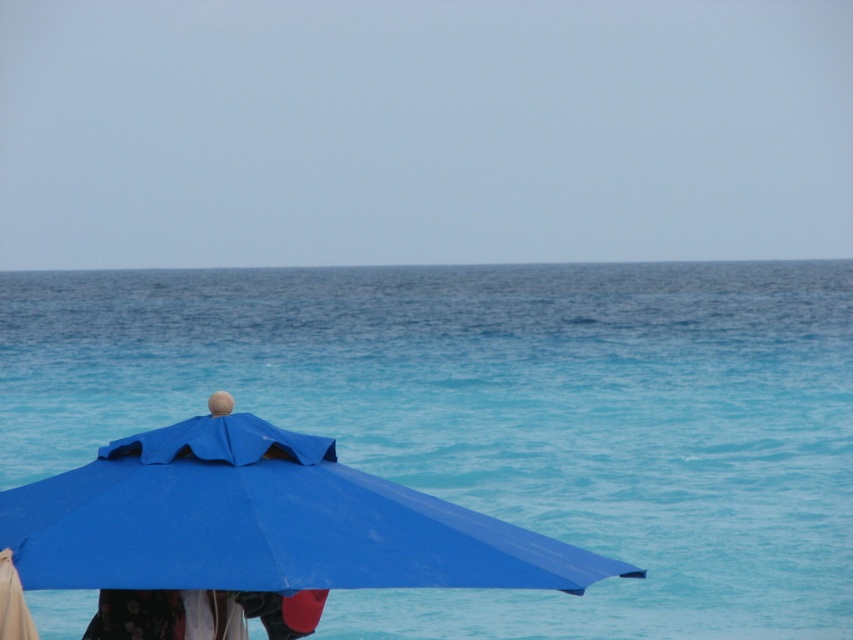
Question: Among these points, which one is farthest from the camera?

Choices:
 (A) (442, 316)
 (B) (167, 600)
 (C) (527, 570)

Answer: (A)

Question: From the image, what is the correct spatial relationship of blue water at center in relation to blue fabric umbrella at lower left?

Choices:
 (A) above
 (B) below

Answer: (A)

Question: Does blue water at center appear under blue fabric umbrella at lower left?

Choices:
 (A) no
 (B) yes

Answer: (A)

Question: Estimate the real-world distances between objects in this image. Which object is closer to the blue fabric umbrella at lower left?

Choices:
 (A) blue water at center
 (B) floral fabric dress at lower left

Answer: (B)

Question: Which of the following is the closest to the observer?

Choices:
 (A) (276, 460)
 (B) (828, 611)
 (C) (299, 602)

Answer: (A)

Question: Where is blue water at center located in relation to blue fabric umbrella at lower left in the image?

Choices:
 (A) below
 (B) above

Answer: (B)